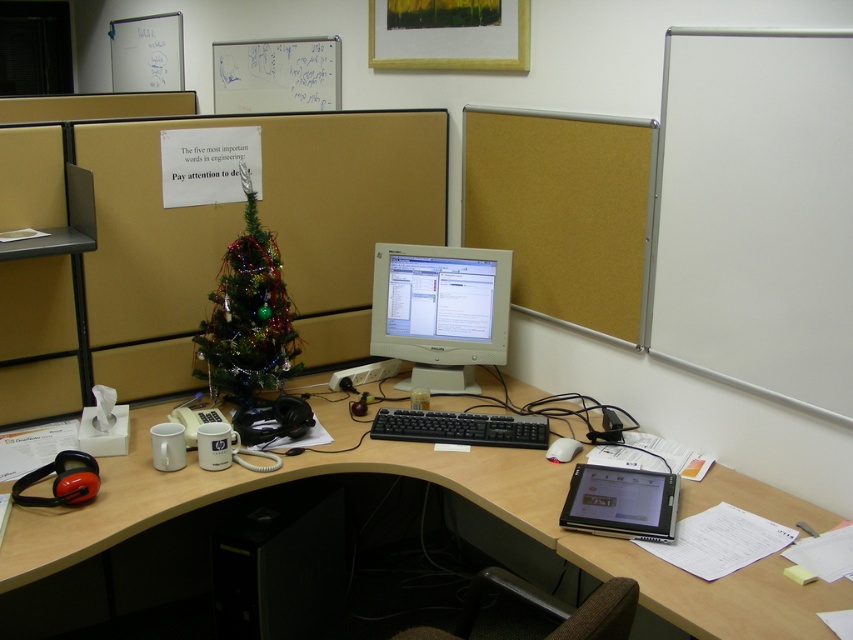
Is light brown wood table at center to the right of silver metallic tablet at lower right from the viewer's perspective?

No, light brown wood table at center is not to the right of silver metallic tablet at lower right.

You are a GUI agent. You are given a task and a screenshot of the screen. Output one action in this format:
    pyautogui.click(x=<x>, y=<y>)
    Task: Click on the light brown wood table at center
    
    Given the screenshot: What is the action you would take?
    pyautogui.click(x=430, y=481)

The height and width of the screenshot is (640, 853). I want to click on light brown wood table at center, so click(x=430, y=481).

Between silver metallic tablet at lower right and white matte mouse at lower right, which one is positioned lower?

silver metallic tablet at lower right is lower down.

Can you confirm if silver metallic tablet at lower right is positioned to the left of white matte mouse at lower right?

In fact, silver metallic tablet at lower right is to the right of white matte mouse at lower right.

Who is more forward, (596,525) or (572,452)?

Point (596,525) is more forward.

I want to click on silver metallic tablet at lower right, so click(x=621, y=502).

Does light brown wood table at center have a smaller size compared to matte gray monitor at center?

No.

In the scene shown: Between light brown wood table at center and matte gray monitor at center, which one is positioned lower?

Positioned lower is light brown wood table at center.

I want to click on light brown wood table at center, so click(x=430, y=481).